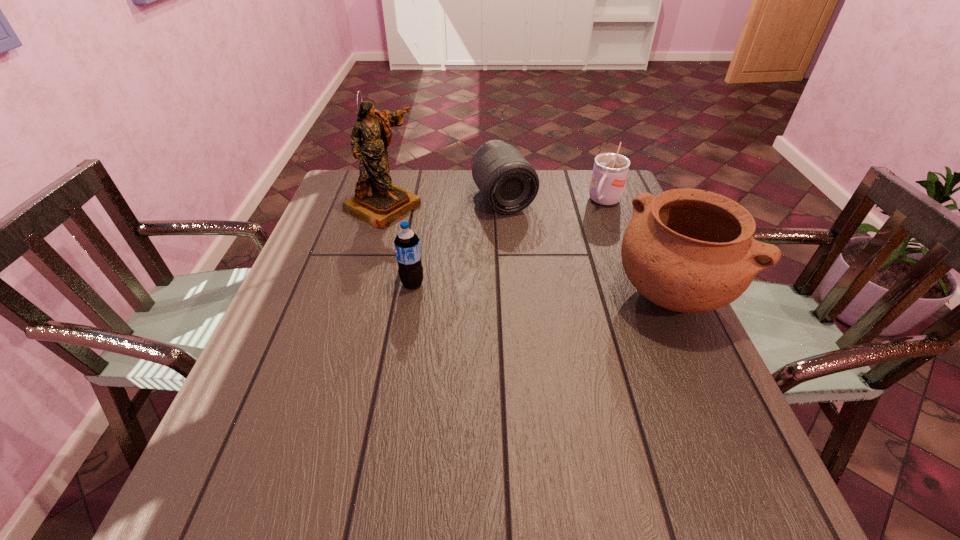
This screenshot has height=540, width=960. I want to click on free point located 0.140m on the surface of the third object from left to right, so click(533, 248).

Where is `vacant region located on the surface of the third object from left to right`? This screenshot has width=960, height=540. vacant region located on the surface of the third object from left to right is located at coordinates (574, 313).

This screenshot has height=540, width=960. I want to click on vacant space situated on the surface of the third object from left to right, so click(x=533, y=248).

Where is `free region located on the side with the handle of the cup`? This screenshot has height=540, width=960. free region located on the side with the handle of the cup is located at coordinates (553, 281).

At what (x,y) coordinates should I click in order to perform the action: click on free space located on the side with the handle of the cup. Please return your answer as a coordinate pair (x, y). Image resolution: width=960 pixels, height=540 pixels. Looking at the image, I should click on pyautogui.click(x=546, y=291).

Where is `vacant space situated 0.210m on the side with the handle of the cup`? vacant space situated 0.210m on the side with the handle of the cup is located at coordinates [574, 251].

Where is `figurine that is at the far edge`? The height and width of the screenshot is (540, 960). figurine that is at the far edge is located at coordinates (377, 201).

Image resolution: width=960 pixels, height=540 pixels. Identify the location of telephoto lens that is at the far edge. (508, 183).

At what (x,y) coordinates should I click in order to perform the action: click on cup situated at the far edge. Please return your answer as a coordinate pair (x, y). This screenshot has width=960, height=540. Looking at the image, I should click on (610, 170).

The image size is (960, 540). Identify the location of object situated at the left edge. (377, 201).